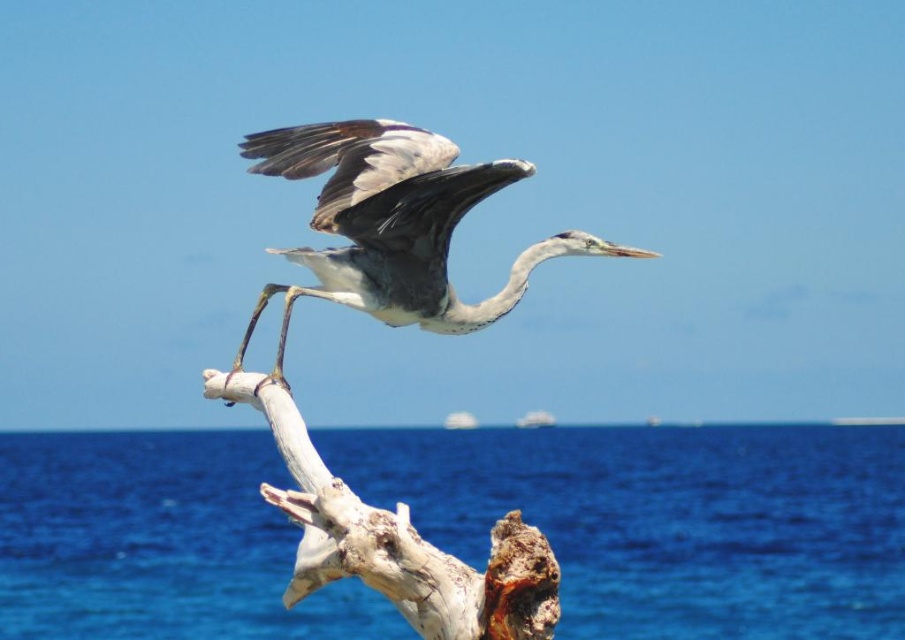
You are standing on the beach and see a bird in mid flight. There is a point marked at coordinates (x=667, y=518). What is located at that point?

The point at coordinates (x=667, y=518) indicates blue water at lower center.

What is the exact location of the blue water at lower center in the image?

The blue water at lower center is located at point coordinates of (667, 518).

You are standing on the beach and see the gray feathered heron at center and the blue water at lower center. Which object is positioned to the left of the other?

The blue water at lower center is positioned to the left of the gray feathered heron at center.